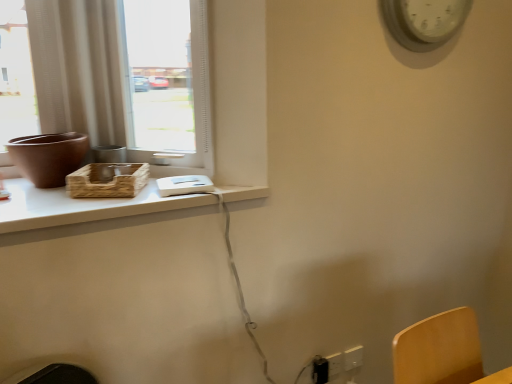
What is the approximate height of white plastic electric outlet at lower right, which ranks as the first electric outlet in right-to-left order?

→ white plastic electric outlet at lower right, which ranks as the first electric outlet in right-to-left order, is 3.73 inches tall.

The image size is (512, 384). Describe the element at coordinates (82, 206) in the screenshot. I see `white plastic tray at upper left` at that location.

Image resolution: width=512 pixels, height=384 pixels. Identify the location of white plastic clock at upper right. (423, 21).

Identify the location of white plastic electric outlet at lower right, which ranks as the first electric outlet in right-to-left order. Image resolution: width=512 pixels, height=384 pixels. (352, 358).

In terms of width, does white plastic electric outlet at lower right, which ranks as the first electric outlet in right-to-left order, look wider or thinner when compared to black plastic electric outlet at lower right, arranged as the first electric outlet when viewed from the left?

Considering their sizes, white plastic electric outlet at lower right, which ranks as the first electric outlet in right-to-left order, looks slimmer than black plastic electric outlet at lower right, arranged as the first electric outlet when viewed from the left.

Which electric outlet is the 2nd one when counting from the front of the white plastic electric outlet at lower right, which ranks as the first electric outlet in right-to-left order? Please provide its 2D coordinates.

[(320, 370)]

Between point (359, 346) and point (315, 362), which one is positioned in front?

Positioned in front is point (315, 362).

Is white plastic electric outlet at lower right, arranged as the third electric outlet when viewed from the left, positioned in front of black plastic electric outlet at lower right, arranged as the first electric outlet when viewed from the left?

That is False.

Which of these two, white plastic electric outlet at lower right, positioned as the 2th electric outlet in left-to-right order, or matte glass window at upper left, stands taller?

With more height is matte glass window at upper left.

Considering the sizes of objects white plastic electric outlet at lower right, acting as the second electric outlet starting from the right, and matte glass window at upper left in the image provided, who is bigger, white plastic electric outlet at lower right, acting as the second electric outlet starting from the right, or matte glass window at upper left?

With larger size is matte glass window at upper left.

From the image's perspective, is white plastic electric outlet at lower right, positioned as the 2th electric outlet in left-to-right order, located beneath matte glass window at upper left?

Correct, white plastic electric outlet at lower right, positioned as the 2th electric outlet in left-to-right order, appears lower than matte glass window at upper left in the image.

Is matte glass window at upper left shorter than woven brown basket at window?

No, matte glass window at upper left is not shorter than woven brown basket at window.

Who is bigger, matte glass window at upper left or woven brown basket at window?

With larger size is matte glass window at upper left.

From the image's perspective, which is below, matte glass window at upper left or woven brown basket at window?

woven brown basket at window appears lower in the image.

Considering the points (338, 372) and (110, 176), which point is behind, point (338, 372) or point (110, 176)?

The point (338, 372) is farther from the camera.

Considering the relative positions of white plastic electric outlet at lower right, positioned as the 2th electric outlet in left-to-right order, and woven brown basket at window in the image provided, is white plastic electric outlet at lower right, positioned as the 2th electric outlet in left-to-right order, to the left of woven brown basket at window from the viewer's perspective?

No.

Considering the relative sizes of white plastic electric outlet at lower right, acting as the second electric outlet starting from the right, and woven brown basket at window in the image provided, is white plastic electric outlet at lower right, acting as the second electric outlet starting from the right, smaller than woven brown basket at window?

Indeed, white plastic electric outlet at lower right, acting as the second electric outlet starting from the right, has a smaller size compared to woven brown basket at window.

How distant is white plastic electric outlet at lower right, acting as the second electric outlet starting from the right, from woven brown basket at window?

1.06 meters.

Is matte glass window at upper left positioned with its back to white plastic clock at upper right?

No, matte glass window at upper left is not facing away from white plastic clock at upper right.

Can you tell me how much matte glass window at upper left and white plastic clock at upper right differ in facing direction?

The angle between the facing direction of matte glass window at upper left and the facing direction of white plastic clock at upper right is 44.6 degrees.

Who is more distant, matte glass window at upper left or white plastic clock at upper right?

white plastic clock at upper right is behind.

Which is behind, point (59, 37) or point (437, 29)?

The point (437, 29) is behind.

Is white plastic clock at upper right facing towards white plastic tray at upper left?

No.

Which point is more forward, (x=463, y=15) or (x=226, y=199)?

The point (x=226, y=199) is closer.

Considering the sizes of objects white plastic clock at upper right and white plastic tray at upper left in the image provided, who is taller, white plastic clock at upper right or white plastic tray at upper left?

Standing taller between the two is white plastic clock at upper right.

Are white plastic clock at upper right and white plastic tray at upper left making contact?

white plastic clock at upper right and white plastic tray at upper left are clearly separated.

From the image's perspective, relative to white plastic tray at upper left, is white plastic electric outlet at lower right, positioned as the 2th electric outlet in left-to-right order, above or below?

From the image's perspective, white plastic electric outlet at lower right, positioned as the 2th electric outlet in left-to-right order, appears below white plastic tray at upper left.

Based on the photo, considering the sizes of objects white plastic electric outlet at lower right, acting as the second electric outlet starting from the right, and white plastic tray at upper left in the image provided, who is smaller, white plastic electric outlet at lower right, acting as the second electric outlet starting from the right, or white plastic tray at upper left?

With smaller size is white plastic electric outlet at lower right, acting as the second electric outlet starting from the right.

Is white plastic electric outlet at lower right, acting as the second electric outlet starting from the right, far from white plastic tray at upper left?

white plastic electric outlet at lower right, acting as the second electric outlet starting from the right, is positioned a significant distance from white plastic tray at upper left.

The width and height of the screenshot is (512, 384). Find the location of `computer desk lying on the left of white plastic electric outlet at lower right, acting as the second electric outlet starting from the right`. computer desk lying on the left of white plastic electric outlet at lower right, acting as the second electric outlet starting from the right is located at coordinates (82, 206).

The height and width of the screenshot is (384, 512). I want to click on electric outlet that is the 1st one when counting downward from the black plastic electric outlet at lower right, arranged as the third electric outlet when viewed from the right (from the image's perspective), so click(x=352, y=358).

The height and width of the screenshot is (384, 512). Identify the location of the 2nd electric outlet to the right of the matte glass window at upper left, counting from the anchor's position. (335, 364).

Based on their spatial positions, is white plastic electric outlet at lower right, acting as the second electric outlet starting from the right, or black plastic electric outlet at lower right, arranged as the first electric outlet when viewed from the left, further from white plastic clock at upper right?

black plastic electric outlet at lower right, arranged as the first electric outlet when viewed from the left, is positioned further to the anchor white plastic clock at upper right.

From the image, which object appears to be nearer to white plastic tray at upper left, matte glass window at upper left or white plastic clock at upper right?

matte glass window at upper left is closer to white plastic tray at upper left.

When comparing their distances from matte glass window at upper left, does woven brown basket at window or matte brown vase at left seem further?

The object further to matte glass window at upper left is woven brown basket at window.

Which object lies nearer to the anchor point white plastic clock at upper right, white plastic tray at upper left or matte brown vase at left?

Based on the image, white plastic tray at upper left appears to be nearer to white plastic clock at upper right.

Which object lies further to the anchor point white plastic electric outlet at lower right, arranged as the third electric outlet when viewed from the left, black plastic electric outlet at lower right, arranged as the third electric outlet when viewed from the right, or white plastic tray at upper left?

white plastic tray at upper left.

Looking at the image, which one is located further to black plastic electric outlet at lower right, arranged as the first electric outlet when viewed from the left, white plastic clock at upper right or white plastic tray at upper left?

white plastic clock at upper right is further to black plastic electric outlet at lower right, arranged as the first electric outlet when viewed from the left.

Looking at this image, from the image, which object appears to be nearer to woven brown basket at window, white plastic tray at upper left or white plastic electric outlet at lower right, which ranks as the first electric outlet in right-to-left order?

white plastic tray at upper left is positioned closer to the anchor woven brown basket at window.

Estimate the real-world distances between objects in this image. Which object is further from white plastic electric outlet at lower right, arranged as the third electric outlet when viewed from the left, matte brown vase at left or matte glass window at upper left?

matte glass window at upper left is further to white plastic electric outlet at lower right, arranged as the third electric outlet when viewed from the left.

Locate an element on the screen. The width and height of the screenshot is (512, 384). computer desk between woven brown basket at window and white plastic electric outlet at lower right, arranged as the third electric outlet when viewed from the left is located at coordinates (82, 206).

Identify the location of vase between matte glass window at upper left and white plastic electric outlet at lower right, positioned as the 2th electric outlet in left-to-right order, in the up-down direction. The image size is (512, 384). (48, 156).

Where is `window situated between white plastic tray at upper left and white plastic clock at upper right from left to right`? The height and width of the screenshot is (384, 512). window situated between white plastic tray at upper left and white plastic clock at upper right from left to right is located at coordinates (79, 68).

Image resolution: width=512 pixels, height=384 pixels. Identify the location of basket between matte brown vase at left and black plastic electric outlet at lower right, arranged as the first electric outlet when viewed from the left, in the horizontal direction. (108, 180).